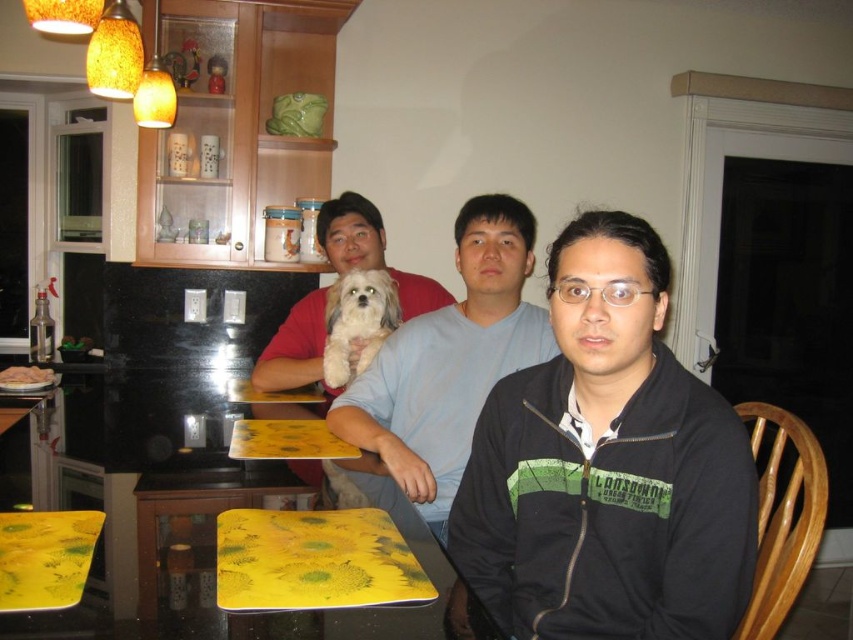
Question: Is black matte jacket at center positioned behind light blue cotton shirt at center?

Choices:
 (A) no
 (B) yes

Answer: (A)

Question: Does white fluffy dog at center lie behind brown crumbly bread at lower left?

Choices:
 (A) yes
 (B) no

Answer: (B)

Question: Which object is closer to the camera taking this photo?

Choices:
 (A) fluffy white dog at center
 (B) light blue cotton shirt at center
 (C) brown crumbly bread at lower left

Answer: (B)

Question: Can you confirm if fluffy white dog at center is bigger than white fluffy dog at center?

Choices:
 (A) yes
 (B) no

Answer: (A)

Question: Among these points, which one is nearest to the camera?

Choices:
 (A) (427, 412)
 (B) (28, 380)
 (C) (558, 298)

Answer: (C)

Question: Which of these objects is positioned closest to the black matte jacket at center?

Choices:
 (A) light blue cotton shirt at center
 (B) brown crumbly bread at lower left

Answer: (A)